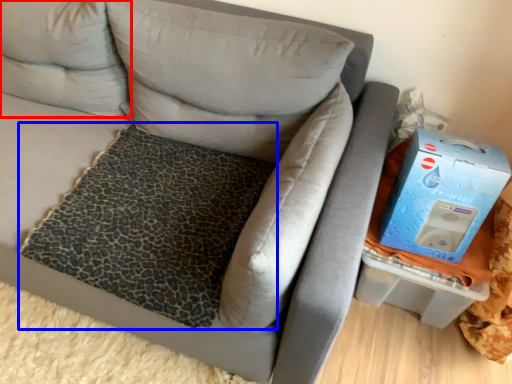
Question: Which object appears farthest to the camera in this image, pillow (highlighted by a red box) or mat (highlighted by a blue box)?

Choices:
 (A) pillow
 (B) mat

Answer: (A)